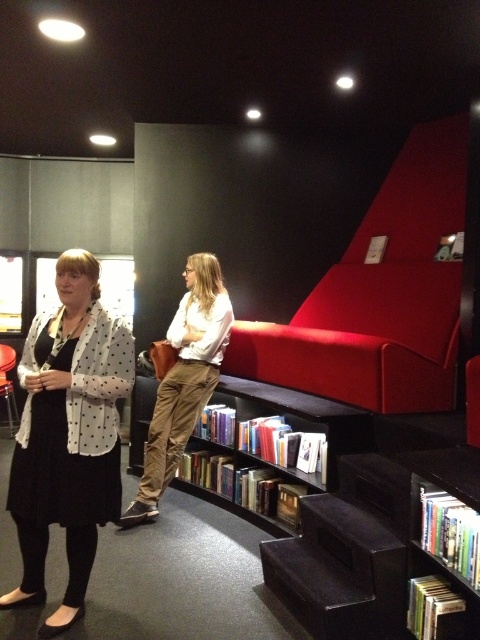
Question: Is white dotted blazer at center positioned before matte white blouse at center?

Choices:
 (A) yes
 (B) no

Answer: (A)

Question: Among these objects, which one is nearest to the camera?

Choices:
 (A) white dotted blazer at center
 (B) wooden bookshelf at lower center

Answer: (A)

Question: Which point is closer to the camera?

Choices:
 (A) (223, 451)
 (B) (74, 262)

Answer: (B)

Question: Does white dotted blazer at center lie behind matte white blouse at center?

Choices:
 (A) no
 (B) yes

Answer: (A)

Question: Can you confirm if white dotted blazer at center is bigger than matte white blouse at center?

Choices:
 (A) no
 (B) yes

Answer: (A)

Question: Which is farther from the wooden bookshelf at lower center?

Choices:
 (A) matte white blouse at center
 (B) white dotted blazer at center

Answer: (B)